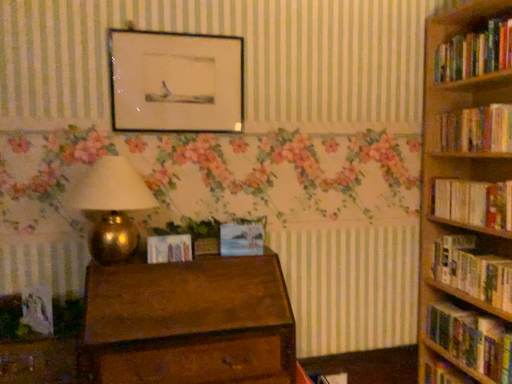
Question: Is hardcover book at right, which is the third book in bottom-to-top order, placed right next to wooden drawer at lower left?

Choices:
 (A) no
 (B) yes

Answer: (A)

Question: Is hardcover book at right, which is the third book in bottom-to-top order, wider than wooden drawer at lower left?

Choices:
 (A) yes
 (B) no

Answer: (B)

Question: Is wooden drawer at lower left at the back of hardcover book at right, which is the third book in bottom-to-top order?

Choices:
 (A) no
 (B) yes

Answer: (A)

Question: Can you confirm if hardcover book at right, positioned as the 3th book in top-to-bottom order, is taller than wooden drawer at lower left?

Choices:
 (A) no
 (B) yes

Answer: (A)

Question: Does hardcover book at right, positioned as the 3th book in top-to-bottom order, have a larger size compared to wooden drawer at lower left?

Choices:
 (A) yes
 (B) no

Answer: (B)

Question: Is point (478, 135) positioned closer to the camera than point (258, 226)?

Choices:
 (A) closer
 (B) farther

Answer: (A)

Question: From a real-world perspective, is hardcover books at right, which ranks as the 2th book in top-to-bottom order, positioned above or below pastel blue canvas painting at center, which is the first paperback book in right-to-left order?

Choices:
 (A) below
 (B) above

Answer: (B)

Question: Considering the positions of hardcover books at right, which ranks as the 4th book in bottom-to-top order, and pastel blue canvas painting at center, which appears as the 2th paperback book when viewed from the left, in the image, is hardcover books at right, which ranks as the 4th book in bottom-to-top order, taller or shorter than pastel blue canvas painting at center, which appears as the 2th paperback book when viewed from the left,?

Choices:
 (A) short
 (B) tall

Answer: (B)

Question: Would you say hardcover books at right, which ranks as the 4th book in bottom-to-top order, is inside or outside pastel blue canvas painting at center, which is the first paperback book in right-to-left order?

Choices:
 (A) inside
 (B) outside

Answer: (B)

Question: From a real-world perspective, is wooden chest of drawers at center positioned above or below hardcover books at right, which is the 5th book in top-to-bottom order?

Choices:
 (A) above
 (B) below

Answer: (A)

Question: Considering their positions, is wooden chest of drawers at center located in front of or behind hardcover books at right, the first book ordered from the bottom?

Choices:
 (A) behind
 (B) front

Answer: (B)

Question: Considering the positions of wooden chest of drawers at center and hardcover books at right, which is the 5th book in top-to-bottom order, in the image, is wooden chest of drawers at center wider or thinner than hardcover books at right, which is the 5th book in top-to-bottom order,?

Choices:
 (A) wide
 (B) thin

Answer: (A)

Question: Is wooden chest of drawers at center inside the boundaries of hardcover books at right, which is the 5th book in top-to-bottom order, or outside?

Choices:
 (A) inside
 (B) outside

Answer: (B)

Question: Choose the correct answer: Is pastel blue canvas painting at center, which is the first paperback book in right-to-left order, inside wooden drawer at lower left or outside it?

Choices:
 (A) outside
 (B) inside

Answer: (A)

Question: Considering the positions of point (248, 241) and point (47, 357), is point (248, 241) closer or farther from the camera than point (47, 357)?

Choices:
 (A) closer
 (B) farther

Answer: (B)